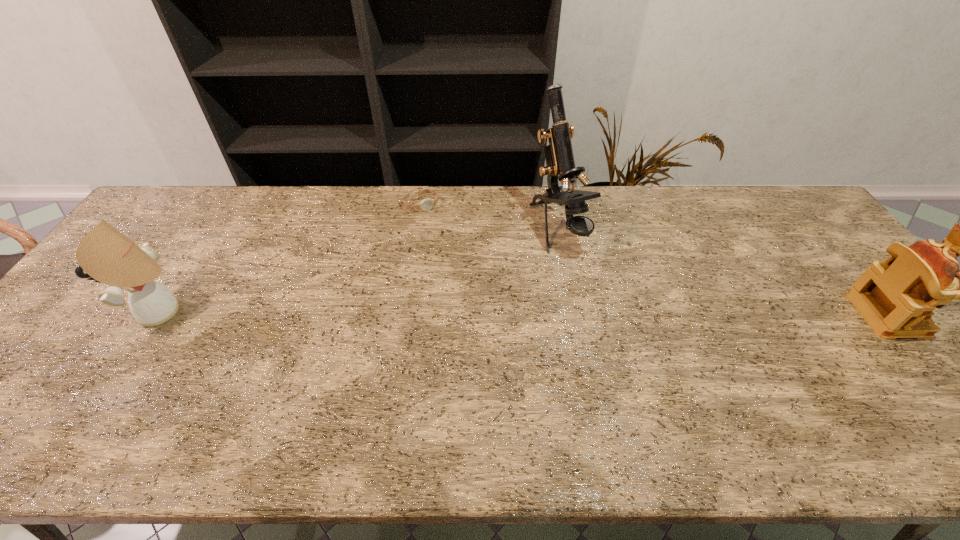
The image size is (960, 540). I want to click on free space on the desktop that is between the leftmost object and the rightmost object and is positioned through the eyepiece of the tallest object, so click(x=625, y=314).

Find the location of a particular element. The width and height of the screenshot is (960, 540). vacant space on the desktop that is between the leftmost object and the figurine and is positioned on the face of the second object from left to right is located at coordinates (488, 313).